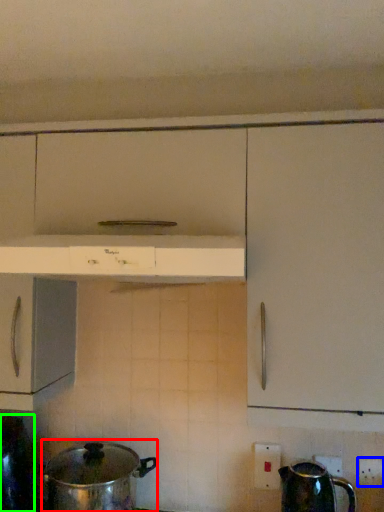
Question: Estimate the real-world distances between objects in this image. Which object is closer to crock pot (highlighted by a red box), electric outlet (highlighted by a blue box) or kitchen appliance (highlighted by a green box)?

Choices:
 (A) electric outlet
 (B) kitchen appliance

Answer: (B)